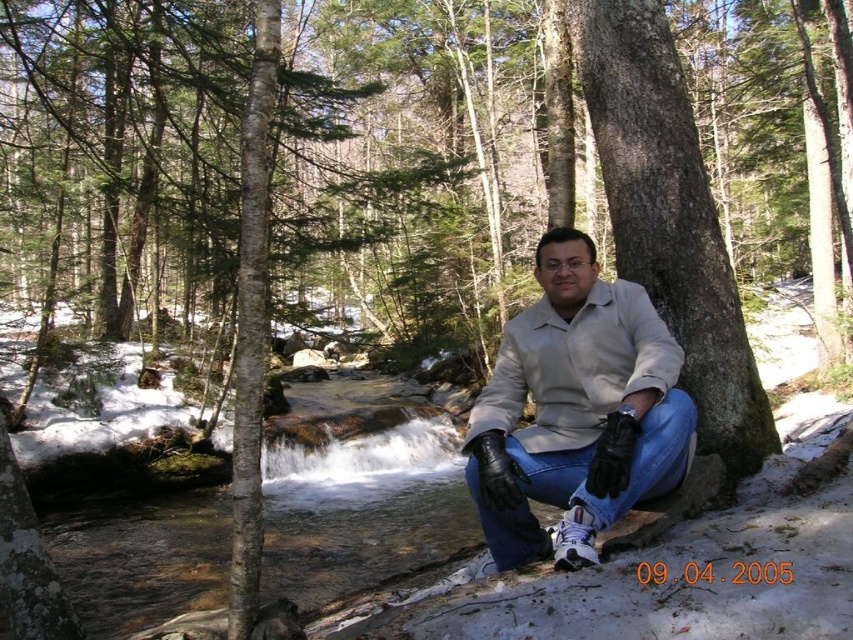
You are a hiker who wants to take a photo of the beige leather jacket at center and the smooth brown tree trunk at center from the same angle. Which object should you place closer to the camera to ensure both are in focus?

The beige leather jacket at center is positioned under the smooth brown tree trunk at center, so to have both in focus, you should place the smooth brown tree trunk at center closer to the camera since it is farther away from the jacket.

You are a hiker who wants to take a photo of the beige leather jacket at center and the smooth bark tree trunk at left. Which object should you focus on first if you want to capture both in one frame without moving the camera?

You should focus on the beige leather jacket at center first because it is positioned below the smooth bark tree trunk at left, so adjusting focus from the lower to the upper part will ensure both are in the frame.

You are a hiker who wants to take a photo of the smooth bark tree trunk at left and the beige leather jacket at center. To frame both in your camera, should you adjust your camera to the left or right?

You should adjust your camera to the right because the beige leather jacket at center is to the right of the smooth bark tree trunk at left.